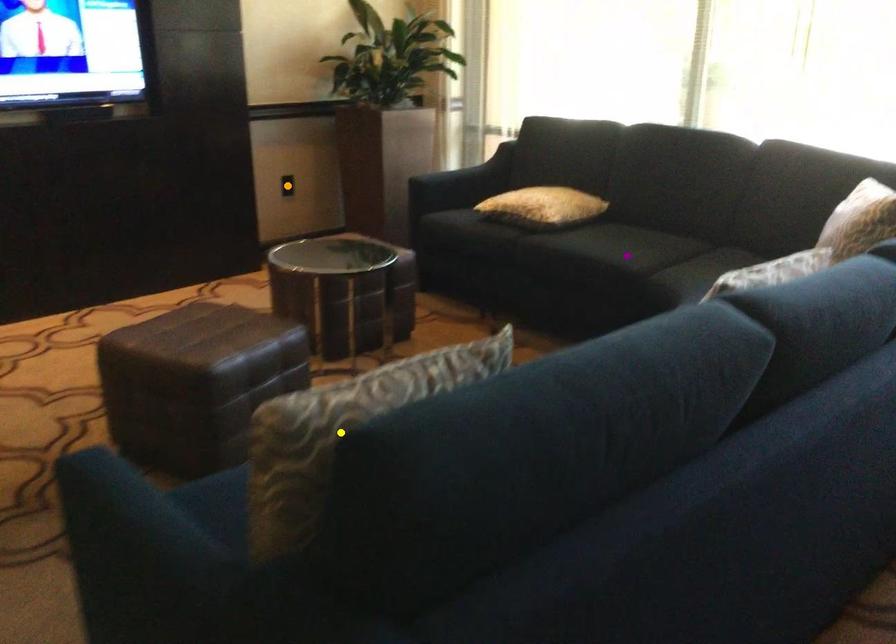
Order these from nearest to farthest:
1. yellow point
2. orange point
3. purple point

yellow point
purple point
orange point